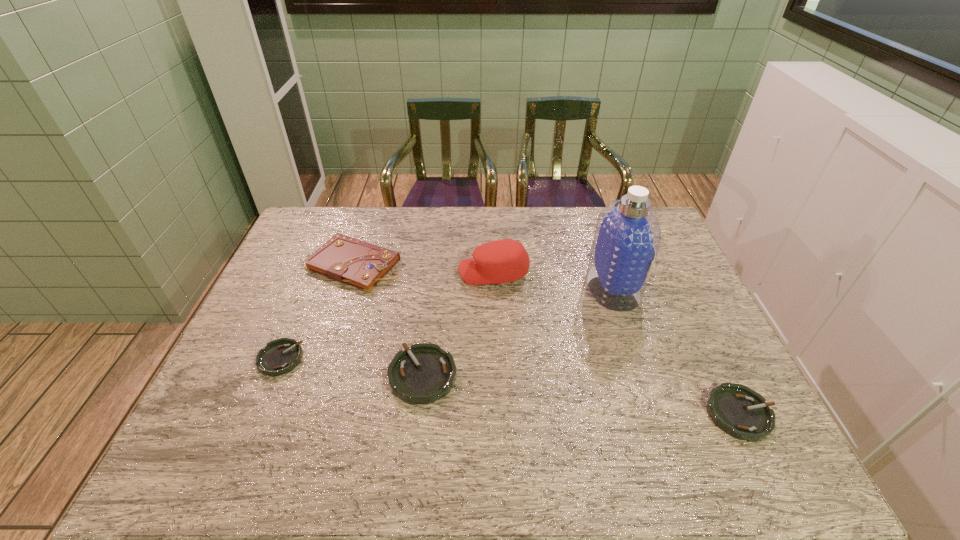
Locate an element on the screen. This screenshot has width=960, height=540. object that stands as the closest to the cap is located at coordinates (627, 236).

Locate which object is the closest to the shortest ashtray. Please provide its 2D coordinates. Your answer should be formatted as a tuple, i.e. [(x, y)], where the tuple contains the x and y coordinates of a point satisfying the conditions above.

[(347, 260)]

Locate which ashtray is the second closest to the fifth object from left to right. Please provide its 2D coordinates. Your answer should be formatted as a tuple, i.e. [(x, y)], where the tuple contains the x and y coordinates of a point satisfying the conditions above.

[(421, 375)]

This screenshot has width=960, height=540. What are the coordinates of `ashtray that is the third nearest to the fifth shortest object` in the screenshot? It's located at (736, 409).

Find the location of a particular element. vacant point that satisfies the following two spatial constraints: 1. on the back side of the cleansing agent; 2. on the front-facing side of the fifth shortest object is located at coordinates (609, 272).

Where is `free space that satisfies the following two spatial constraints: 1. on the front-facing side of the tallest object; 2. on the right side of the second tallest object`? This screenshot has height=540, width=960. free space that satisfies the following two spatial constraints: 1. on the front-facing side of the tallest object; 2. on the right side of the second tallest object is located at coordinates (494, 287).

This screenshot has height=540, width=960. Find the location of `vacant position in the image that satisfies the following two spatial constraints: 1. on the front side of the tallest object; 2. on the left side of the notebook`. vacant position in the image that satisfies the following two spatial constraints: 1. on the front side of the tallest object; 2. on the left side of the notebook is located at coordinates (348, 287).

Locate an element on the screen. The height and width of the screenshot is (540, 960). free location that satisfies the following two spatial constraints: 1. on the back side of the fourth shortest object; 2. on the right side of the shortest object is located at coordinates (320, 265).

This screenshot has width=960, height=540. I want to click on vacant space that satisfies the following two spatial constraints: 1. on the front side of the cleansing agent; 2. on the left side of the second shortest ashtray, so click(655, 414).

This screenshot has height=540, width=960. What are the coordinates of `free spot that satisfies the following two spatial constraints: 1. on the front-facing side of the cap; 2. on the front side of the leftmost ashtray` in the screenshot? It's located at (496, 359).